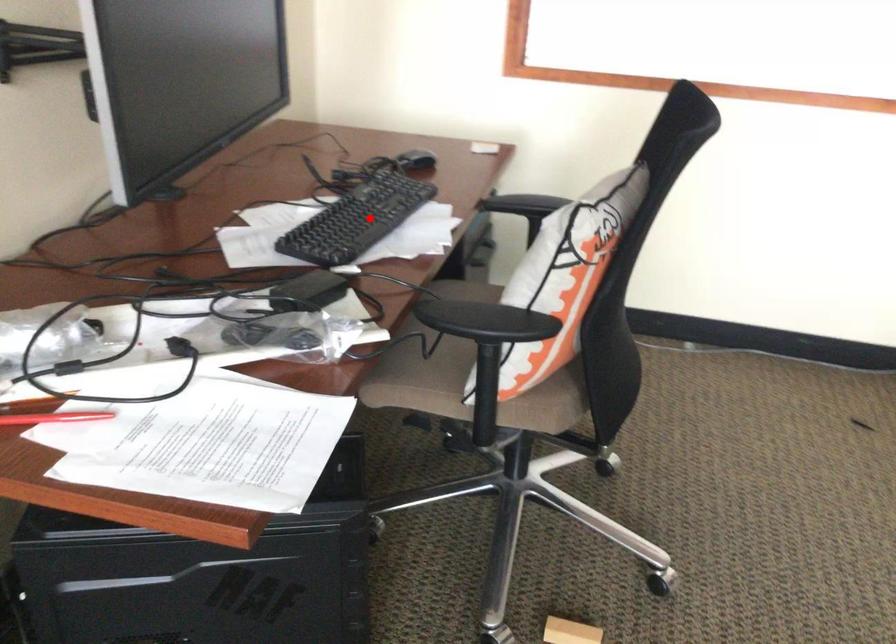
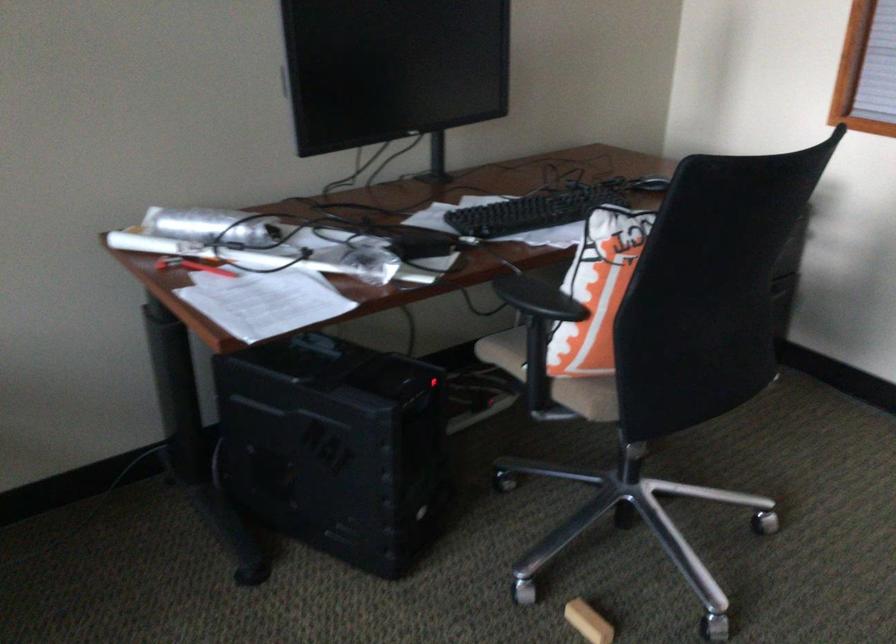
Question: I am providing you with two images of the same scene from different viewpoints. Image1 has a red point marked. In image2, the corresponding 3D location appears at what relative position? Reply with the corresponding letter.

Choices:
 (A) Closer
 (B) Farther

Answer: (B)